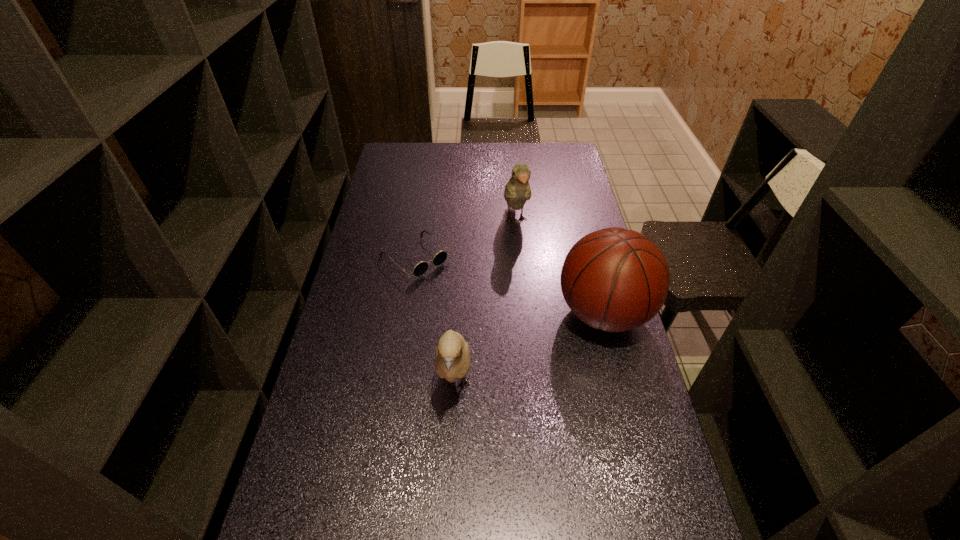
At what (x,y) coordinates should I click in order to perform the action: click on vacant space that satisfies the following two spatial constraints: 1. on the back side of the shortest object; 2. on the left side of the right bird. Please return your answer as a coordinate pair (x, y). Looking at the image, I should click on (421, 220).

I want to click on vacant position in the image that satisfies the following two spatial constraints: 1. on the front side of the shortest object; 2. on the left side of the rightmost object, so click(x=407, y=313).

Locate an element on the screen. The image size is (960, 540). vacant area in the image that satisfies the following two spatial constraints: 1. on the front side of the sunglasses; 2. on the left side of the basketball is located at coordinates (407, 313).